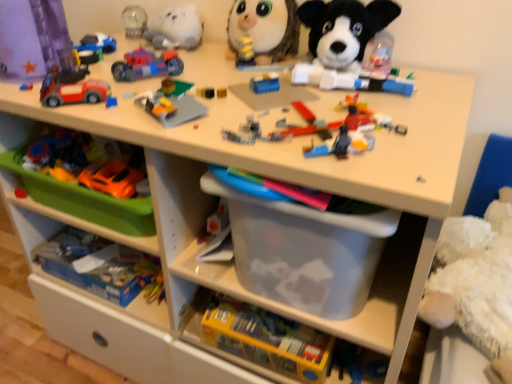
Locate an element on the screen. free space between soft plush dog at upper center, which is the 3th toy in top-to-bottom order, and yellow striped plush at upper center, arranged as the ninth toy when ordered from the bottom is located at coordinates (275, 67).